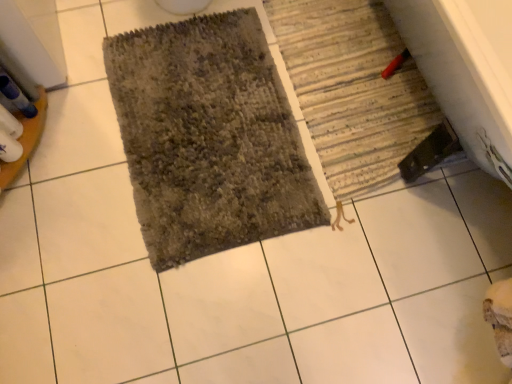
Question: Looking at their shapes, would you say striped fabric bath mat at lower right, which is the first bath mat in right-to-left order, is wider or thinner than textured gray bath mat at center, which is the 2th bath mat in right-to-left order?

Choices:
 (A) thin
 (B) wide

Answer: (A)

Question: Considering the positions of striped fabric bath mat at lower right, which is the first bath mat in right-to-left order, and textured gray bath mat at center, which is the 2th bath mat in right-to-left order, in the image, is striped fabric bath mat at lower right, which is the first bath mat in right-to-left order, bigger or smaller than textured gray bath mat at center, which is the 2th bath mat in right-to-left order,?

Choices:
 (A) small
 (B) big

Answer: (A)

Question: Does point (370, 182) appear closer or farther from the camera than point (141, 183)?

Choices:
 (A) farther
 (B) closer

Answer: (A)

Question: Which is correct: textured gray bath mat at center, the 1th bath mat viewed from the left, is inside striped fabric bath mat at lower right, which is the first bath mat in right-to-left order, or outside of it?

Choices:
 (A) inside
 (B) outside

Answer: (B)

Question: In terms of size, does textured gray bath mat at center, which is the 2th bath mat in right-to-left order, appear bigger or smaller than striped fabric bath mat at lower right, the second bath mat viewed from the left?

Choices:
 (A) small
 (B) big

Answer: (B)

Question: Considering the positions of textured gray bath mat at center, which is the 2th bath mat in right-to-left order, and striped fabric bath mat at lower right, which is the first bath mat in right-to-left order, in the image, is textured gray bath mat at center, which is the 2th bath mat in right-to-left order, taller or shorter than striped fabric bath mat at lower right, which is the first bath mat in right-to-left order,?

Choices:
 (A) short
 (B) tall

Answer: (A)

Question: Looking at their shapes, would you say textured gray bath mat at center, which is the 2th bath mat in right-to-left order, is wider or thinner than striped fabric bath mat at lower right, which is the first bath mat in right-to-left order?

Choices:
 (A) thin
 (B) wide

Answer: (B)